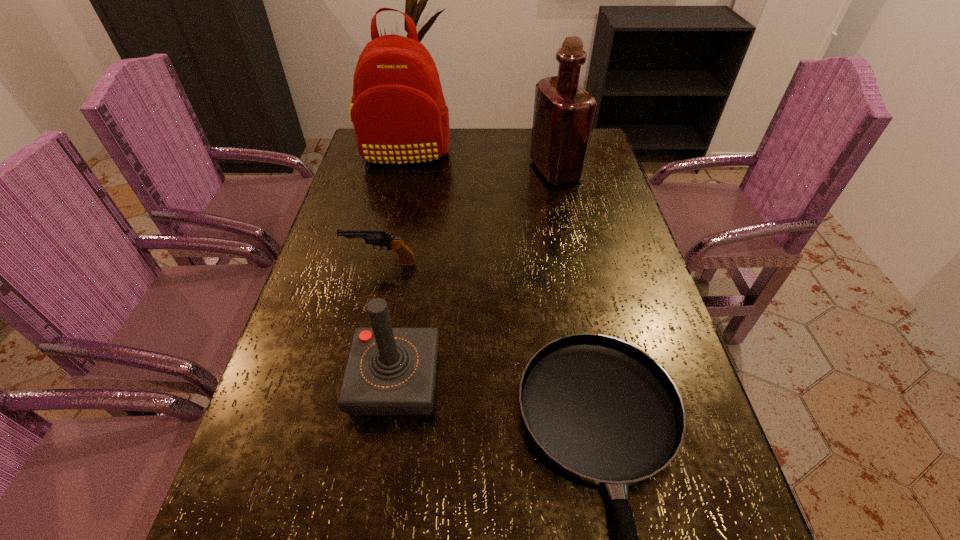
Locate an element on the screen. The height and width of the screenshot is (540, 960). backpack is located at coordinates (399, 114).

At what (x,y) coordinates should I click in order to perform the action: click on liquor. Please return your answer as a coordinate pair (x, y). Looking at the image, I should click on (564, 113).

This screenshot has height=540, width=960. In order to click on joystick in this screenshot , I will do `click(390, 371)`.

The width and height of the screenshot is (960, 540). Find the location of `the third nearest object`. the third nearest object is located at coordinates (380, 238).

Find the location of a particular element. This screenshot has height=540, width=960. gun is located at coordinates point(380,238).

I want to click on blank space located 0.230m on the front-facing side of the backpack, so click(391, 214).

Find the location of a particular element. The image size is (960, 540). vacant space located 0.080m on the left of the liquor is located at coordinates [x=506, y=170].

What are the coordinates of `free point located 0.160m on the rectangular base of the third shortest object` in the screenshot? It's located at point(375,513).

This screenshot has width=960, height=540. Identify the location of free space located along the barrel of the third nearest object. [323, 263].

Where is `backpack situated at the far edge`? The image size is (960, 540). backpack situated at the far edge is located at coordinates (399, 114).